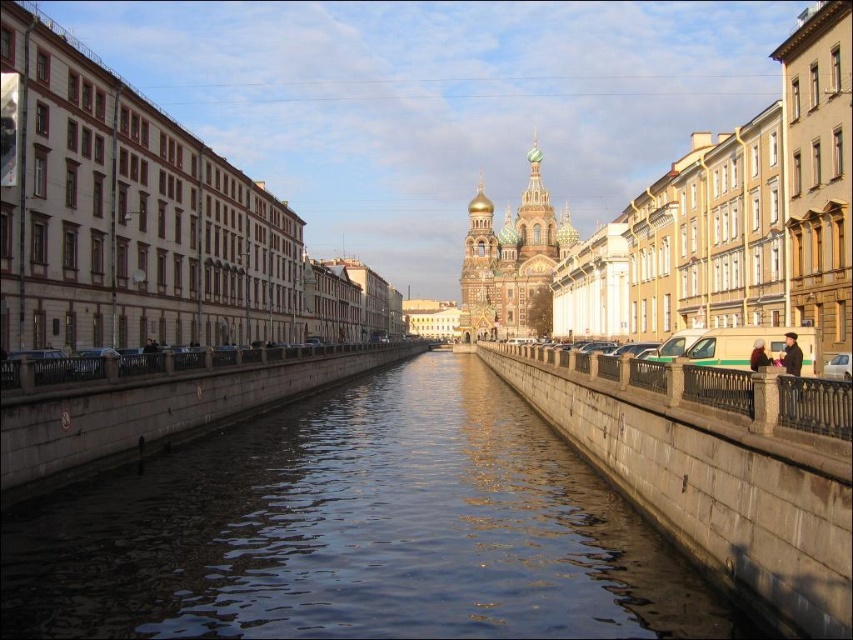
You are standing on a bridge overlooking the canal and want to take a photo of the gold domed cathedral at center. However, you notice that the smooth concrete water at center might obstruct your view. Based on their positions, can you determine if the water will block the cathedral in your photo?

The smooth concrete water at center is located below the gold domed cathedral at center, so the water will not block the cathedral in your photo since it is positioned beneath it.

You are a tourist standing on the left bank of the canal. You want to take a photo of the gold domed cathedral at center and the light brown leather jacket at right. Which object should you frame first in your camera viewfinder to ensure both are in the shot?

You should frame the gold domed cathedral at center first because it is positioned over the light brown leather jacket at right, meaning it is closer to you and would appear larger in the frame, ensuring both are visible when centered.